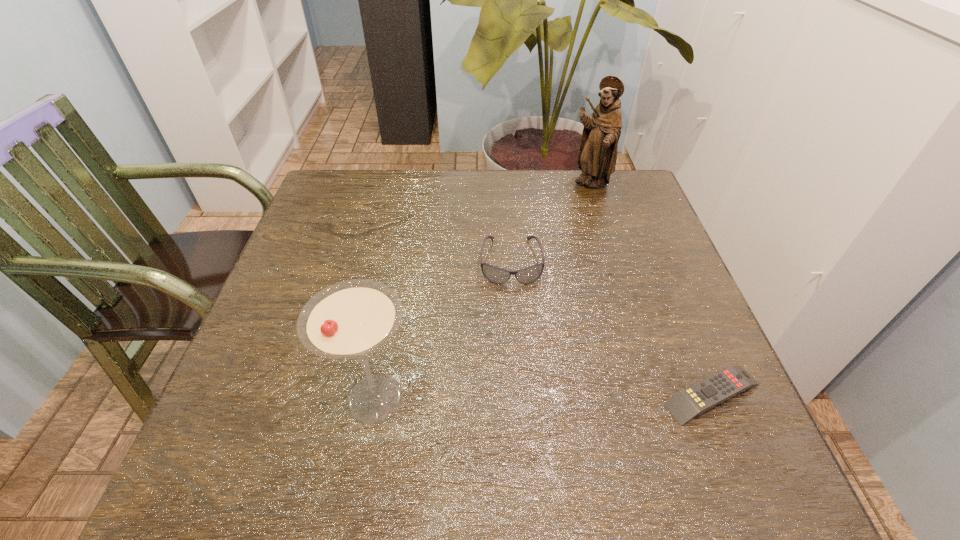
You are a GUI agent. You are given a task and a screenshot of the screen. Output one action in this format:
    pyautogui.click(x=<x>, y=<y>)
    Task: Click on the object located in the far right corner section of the desktop
    The image size is (960, 540).
    Given the screenshot: What is the action you would take?
    pyautogui.click(x=597, y=156)

At what (x,y) coordinates should I click in order to perform the action: click on object situated at the near right corner. Please return your answer as a coordinate pair (x, y). Looking at the image, I should click on [712, 391].

Where is `free space at the far edge of the desktop`? Image resolution: width=960 pixels, height=540 pixels. free space at the far edge of the desktop is located at coordinates (399, 220).

The image size is (960, 540). Find the location of `vacant point at the near edge`. vacant point at the near edge is located at coordinates (348, 391).

Where is `vacant space at the left edge of the desktop`? vacant space at the left edge of the desktop is located at coordinates (315, 366).

In the image, there is a desktop. Where is `free space at the right edge`? This screenshot has width=960, height=540. free space at the right edge is located at coordinates (636, 304).

Where is `vacant space at the far left corner of the desktop`? The height and width of the screenshot is (540, 960). vacant space at the far left corner of the desktop is located at coordinates (329, 176).

This screenshot has width=960, height=540. In order to click on free space at the near left corner of the desktop in this screenshot , I will do `click(290, 408)`.

The height and width of the screenshot is (540, 960). In order to click on vacant space at the near right corner of the desktop in this screenshot , I will do tap(723, 414).

What are the coordinates of `vacant area that lies between the figurine and the second shortest object` in the screenshot? It's located at (550, 223).